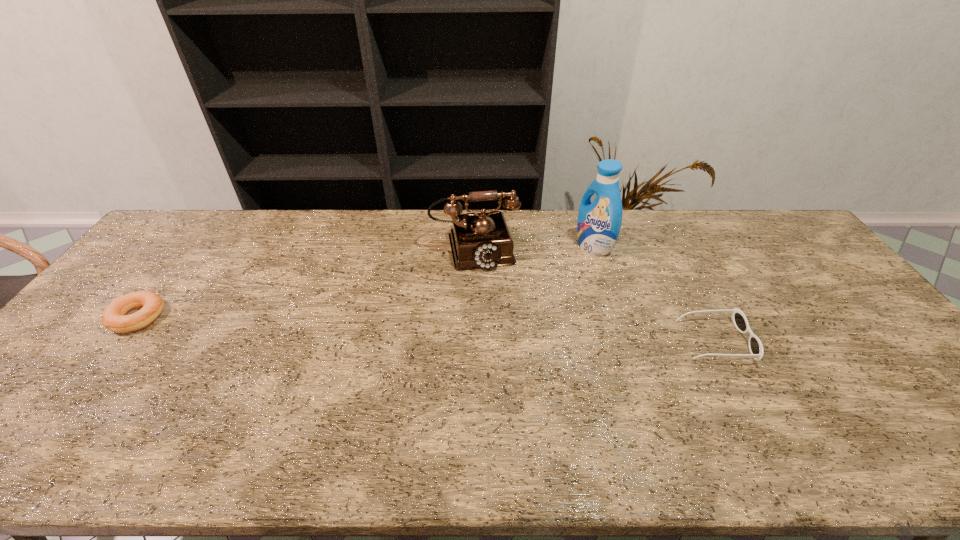
Find the location of a particular element. This screenshot has height=540, width=960. bagel is located at coordinates (114, 317).

Identify the location of sunglasses. (739, 319).

The height and width of the screenshot is (540, 960). In order to click on the third object from right to left in this screenshot , I will do `click(482, 240)`.

Identify the location of the second tallest object. (482, 240).

Find the location of a particular element. The height and width of the screenshot is (540, 960). detergent is located at coordinates (598, 225).

Identify the location of the tallest object. (598, 225).

You are a GUI agent. You are given a task and a screenshot of the screen. Output one action in this format:
    pyautogui.click(x=<x>, y=<y>)
    Task: Click on the vacant area situated on the back of the leftmost object
    The image size is (960, 540).
    Given the screenshot: What is the action you would take?
    pyautogui.click(x=165, y=283)

At what (x,y) coordinates should I click in order to perform the action: click on blank area located with the lenses of the sunglasses facing outward. Please return your answer as a coordinate pair (x, y). Looking at the image, I should click on (834, 341).

Where is `vacant space located on the dial of the second tallest object`? The width and height of the screenshot is (960, 540). vacant space located on the dial of the second tallest object is located at coordinates (492, 322).

Find the location of `vacant space located 0.300m on the dial of the second tallest object`. vacant space located 0.300m on the dial of the second tallest object is located at coordinates (497, 347).